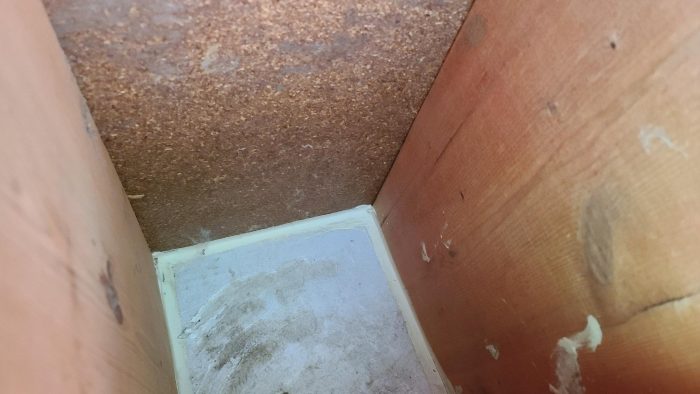
Locate an element on the screen. nail hole in right wood panel is located at coordinates (612, 46).